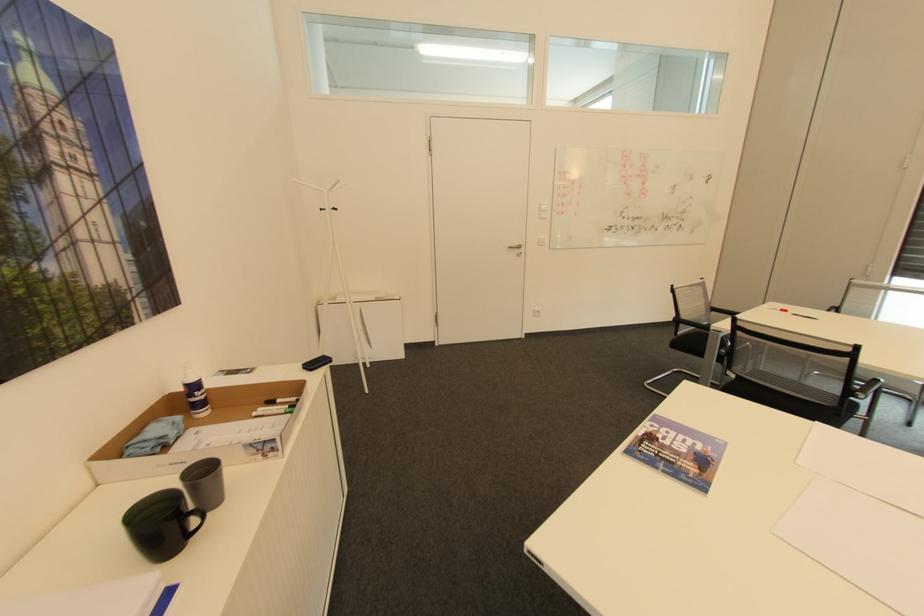
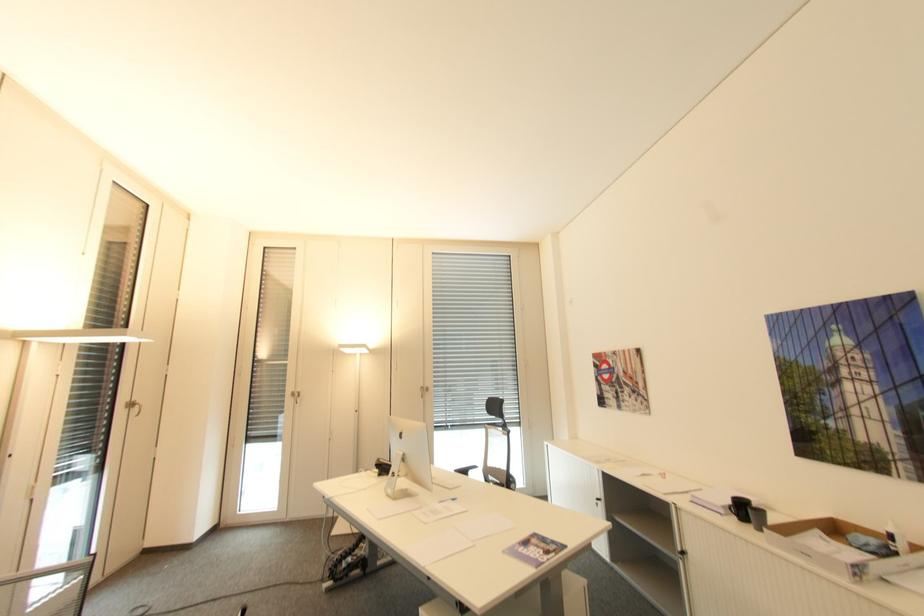
In the second image, find the point that corresponds to point (730, 442) in the first image.

(507, 553)